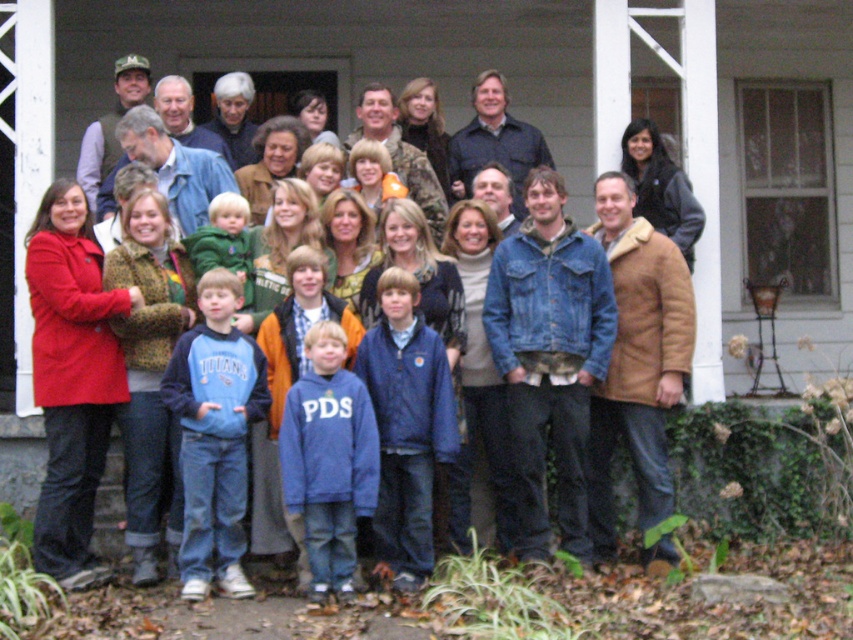
Question: Which of these objects is positioned closest to the dark blue denim jacket at center?

Choices:
 (A) tan suede coat at lower right
 (B) blue fleece jacket at center
 (C) blue fleece sweatshirt at center

Answer: (A)

Question: In this image, where is tan suede coat at lower right located relative to denim jacket at center?

Choices:
 (A) right
 (B) left

Answer: (A)

Question: Does blue fleece jacket at center have a smaller size compared to blue fleece sweatshirt at center?

Choices:
 (A) yes
 (B) no

Answer: (B)

Question: Is navy blue fleece at center positioned in front of dark blue denim jacket at center?

Choices:
 (A) no
 (B) yes

Answer: (B)

Question: Among these objects, which one is farthest from the camera?

Choices:
 (A) dark blue denim jacket at center
 (B) tan suede coat at lower right
 (C) blue fleece sweatshirt at center

Answer: (A)

Question: Estimate the real-world distances between objects in this image. Which object is farther from the navy blue fleece at center?

Choices:
 (A) blue fleece sweatshirt at center
 (B) denim jacket at center
 (C) tan suede coat at lower right
 (D) blue fleece jacket at center

Answer: (B)